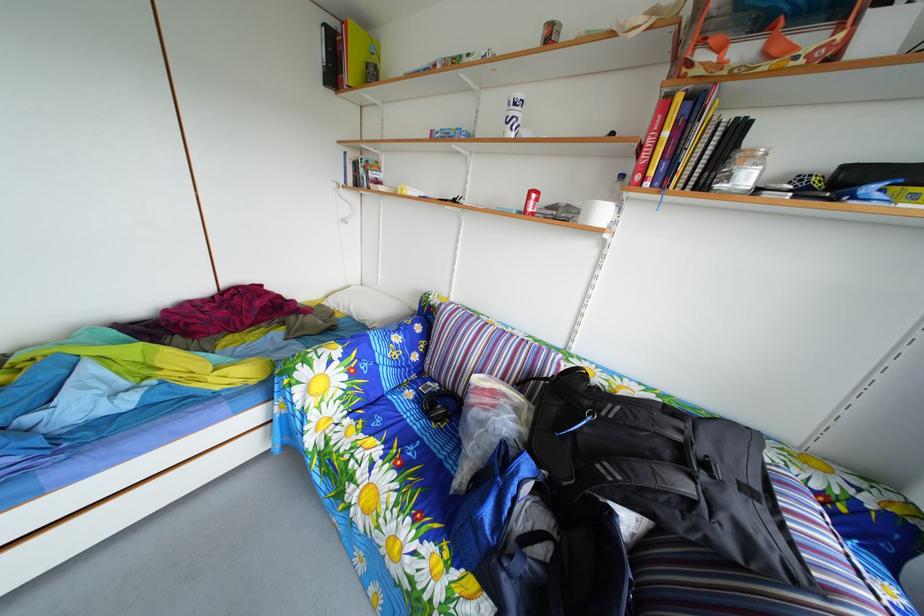
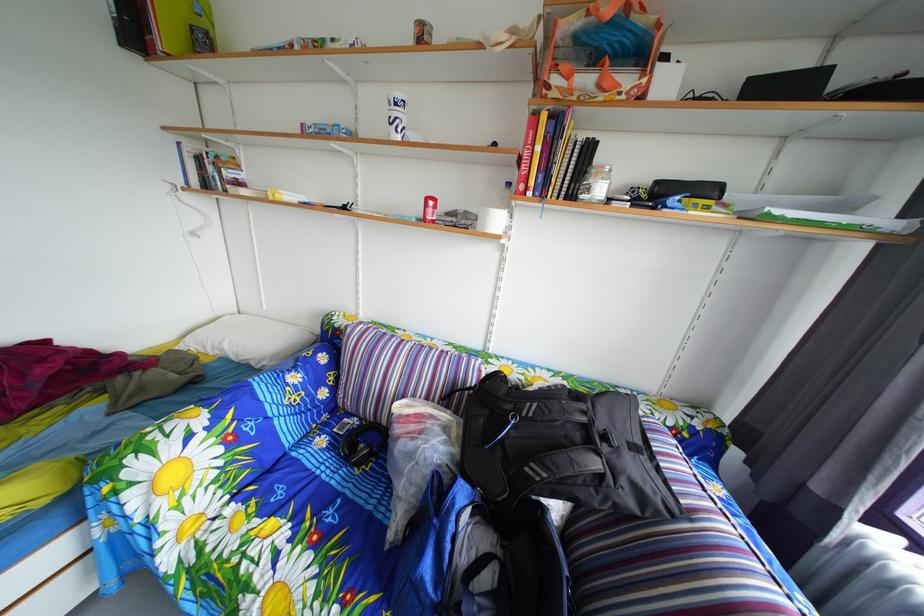
The point at (355, 315) is marked in the first image. Where is the corresponding point in the second image?

(224, 357)